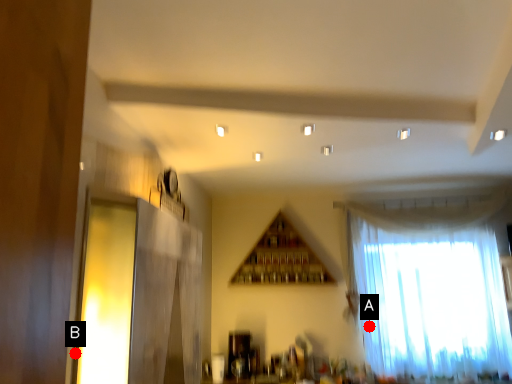
Question: Two points are circled on the image, labeled by A and B beside each circle. Which point is closer to the camera taking this photo?

Choices:
 (A) A is closer
 (B) B is closer

Answer: (B)